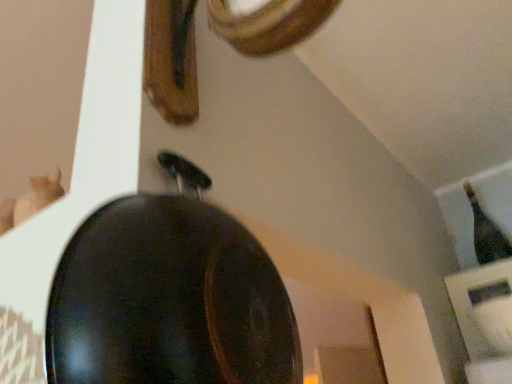
Question: Can you confirm if shiny black frying pan at center is positioned to the right of green glass bottle at upper right?

Choices:
 (A) no
 (B) yes

Answer: (A)

Question: Can you confirm if shiny black frying pan at center is positioned to the left of green glass bottle at upper right?

Choices:
 (A) no
 (B) yes

Answer: (B)

Question: From the image's perspective, is shiny black frying pan at center below green glass bottle at upper right?

Choices:
 (A) yes
 (B) no

Answer: (B)

Question: Is the position of shiny black frying pan at center less distant than that of green glass bottle at upper right?

Choices:
 (A) no
 (B) yes

Answer: (B)

Question: Can you confirm if shiny black frying pan at center is smaller than green glass bottle at upper right?

Choices:
 (A) yes
 (B) no

Answer: (B)

Question: Considering the relative sizes of shiny black frying pan at center and green glass bottle at upper right in the image provided, is shiny black frying pan at center bigger than green glass bottle at upper right?

Choices:
 (A) yes
 (B) no

Answer: (A)

Question: Does green glass bottle at upper right have a greater width compared to shiny black frying pan at center?

Choices:
 (A) no
 (B) yes

Answer: (B)

Question: Can you confirm if green glass bottle at upper right is taller than shiny black frying pan at center?

Choices:
 (A) yes
 (B) no

Answer: (A)

Question: Can you confirm if green glass bottle at upper right is smaller than shiny black frying pan at center?

Choices:
 (A) yes
 (B) no

Answer: (A)

Question: Is the depth of green glass bottle at upper right greater than that of shiny black frying pan at center?

Choices:
 (A) yes
 (B) no

Answer: (A)

Question: From the image's perspective, is green glass bottle at upper right on top of shiny black frying pan at center?

Choices:
 (A) no
 (B) yes

Answer: (A)

Question: Is green glass bottle at upper right facing away from shiny black frying pan at center?

Choices:
 (A) no
 (B) yes

Answer: (A)

Question: Would you say green glass bottle at upper right is to the left or to the right of shiny black frying pan at center in the picture?

Choices:
 (A) left
 (B) right

Answer: (B)